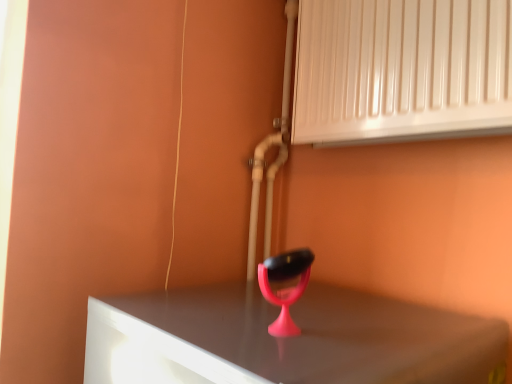
Identify the location of white glossy radiator at upper right. (401, 69).

Measure the distance between white glossy radiator at upper right and camera.

white glossy radiator at upper right is 75.13 centimeters away from camera.

Image resolution: width=512 pixels, height=384 pixels. What do you see at coordinates (401, 69) in the screenshot?
I see `white glossy radiator at upper right` at bounding box center [401, 69].

Describe the element at coordinates (285, 288) in the screenshot. I see `pink plastic table lamp at center` at that location.

Locate an element on the screen. pink plastic table lamp at center is located at coordinates (285, 288).

Locate an element on the screen. This screenshot has height=384, width=512. white glossy radiator at upper right is located at coordinates (401, 69).

In the image, is pink plastic table lamp at center on the left side or the right side of white glossy radiator at upper right?

In the image, pink plastic table lamp at center appears on the left side of white glossy radiator at upper right.

Is pink plastic table lamp at center closer to the viewer compared to white glossy radiator at upper right?

Yes.

Considering the positions of point (276, 327) and point (369, 66), is point (276, 327) closer or farther from the camera than point (369, 66)?

Point (276, 327).

From the image's perspective, which one is positioned lower, pink plastic table lamp at center or white glossy radiator at upper right?

pink plastic table lamp at center, from the image's perspective.

From a real-world perspective, does pink plastic table lamp at center sit lower than white glossy radiator at upper right?

Yes, from a real-world perspective, pink plastic table lamp at center is beneath white glossy radiator at upper right.

Is pink plastic table lamp at center wider or thinner than white glossy radiator at upper right?

pink plastic table lamp at center is thinner than white glossy radiator at upper right.

Which of these two, pink plastic table lamp at center or white glossy radiator at upper right, stands taller?

Standing taller between the two is white glossy radiator at upper right.

Is pink plastic table lamp at center bigger than white glossy radiator at upper right?

Incorrect, pink plastic table lamp at center is not larger than white glossy radiator at upper right.

Do you think pink plastic table lamp at center is within white glossy radiator at upper right, or outside of it?

pink plastic table lamp at center is not inside white glossy radiator at upper right, it's outside.

In the scene shown: Is pink plastic table lamp at center not near white glossy radiator at upper right?

No.

From the picture: Is pink plastic table lamp at center facing away from white glossy radiator at upper right?

No, white glossy radiator at upper right is not at the back of pink plastic table lamp at center.

What's the angular difference between pink plastic table lamp at center and white glossy radiator at upper right's facing directions?

86.6 degrees separate the facing orientations of pink plastic table lamp at center and white glossy radiator at upper right.

Measure the distance from pink plastic table lamp at center to white glossy radiator at upper right.

pink plastic table lamp at center is 18.63 inches away from white glossy radiator at upper right.

In the image, there is a white glossy radiator at upper right. Where is `table lamp below it (from a real-world perspective)`? The image size is (512, 384). table lamp below it (from a real-world perspective) is located at coordinates (285, 288).

Is white glossy radiator at upper right to the right of pink plastic table lamp at center from the viewer's perspective?

Correct, you'll find white glossy radiator at upper right to the right of pink plastic table lamp at center.

Which object is more forward, white glossy radiator at upper right or pink plastic table lamp at center?

pink plastic table lamp at center.

Considering the positions of point (439, 96) and point (277, 297), is point (439, 96) closer or farther from the camera than point (277, 297)?

Point (439, 96) is positioned farther from the camera compared to point (277, 297).

Consider the image. From the image's perspective, which is above, white glossy radiator at upper right or pink plastic table lamp at center?

From the image's view, white glossy radiator at upper right is above.

From a real-world perspective, is white glossy radiator at upper right physically above pink plastic table lamp at center?

Indeed, from a real-world perspective, white glossy radiator at upper right stands above pink plastic table lamp at center.

Which of these two, white glossy radiator at upper right or pink plastic table lamp at center, is thinner?

Thinner between the two is pink plastic table lamp at center.

Is white glossy radiator at upper right taller than pink plastic table lamp at center?

Yes, white glossy radiator at upper right is taller than pink plastic table lamp at center.

Based on their sizes in the image, would you say white glossy radiator at upper right is bigger or smaller than pink plastic table lamp at center?

Clearly, white glossy radiator at upper right is larger in size than pink plastic table lamp at center.

Could pink plastic table lamp at center be considered to be inside white glossy radiator at upper right?

No.

Consider the image. Is white glossy radiator at upper right in contact with pink plastic table lamp at center?

white glossy radiator at upper right and pink plastic table lamp at center are not in contact.

Is white glossy radiator at upper right facing towards pink plastic table lamp at center?

No, white glossy radiator at upper right does not turn towards pink plastic table lamp at center.

How different are the orientations of white glossy radiator at upper right and pink plastic table lamp at center in degrees?

86.6 degrees separate the facing orientations of white glossy radiator at upper right and pink plastic table lamp at center.

Measure the distance between white glossy radiator at upper right and pink plastic table lamp at center.

white glossy radiator at upper right and pink plastic table lamp at center are 18.63 inches apart from each other.

The image size is (512, 384). I want to click on table lamp that is on the left side of white glossy radiator at upper right, so point(285,288).

Find the location of a particular element. The height and width of the screenshot is (384, 512). table lamp that is on the left side of white glossy radiator at upper right is located at coordinates (285, 288).

At what (x,y) coordinates should I click in order to perform the action: click on air conditioning located above the pink plastic table lamp at center (from the image's perspective). Please return your answer as a coordinate pair (x, y). The height and width of the screenshot is (384, 512). Looking at the image, I should click on (401, 69).